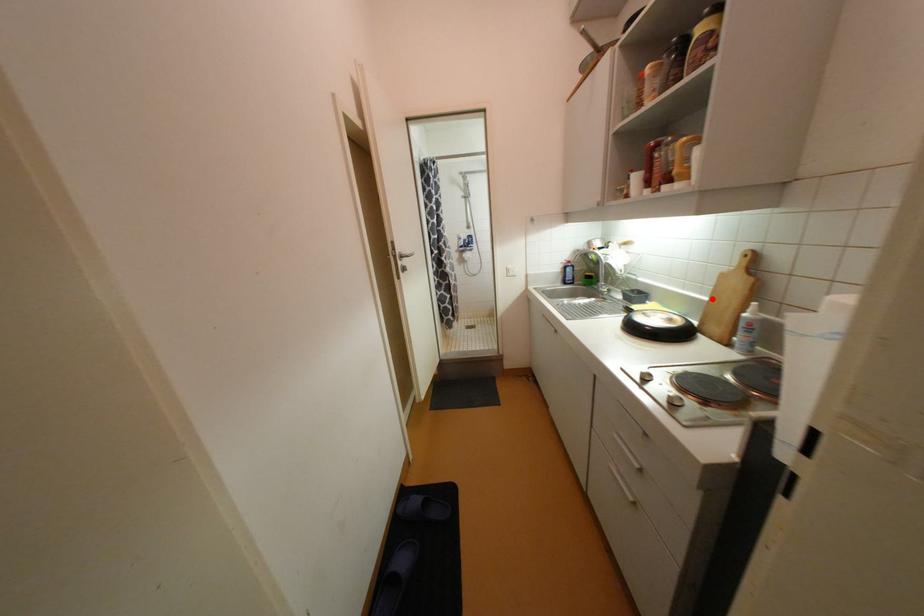
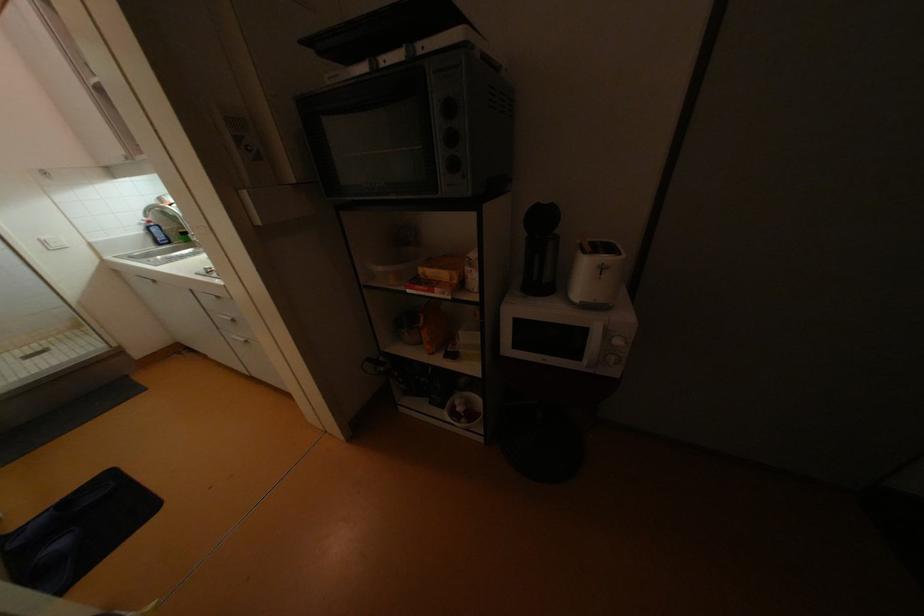
Question: I am providing you with two images of the same scene from different viewpoints. A red point is marked on the first image. At the location where the point appears in image 1, is it still visible in image 2?

Choices:
 (A) Yes
 (B) No

Answer: (B)